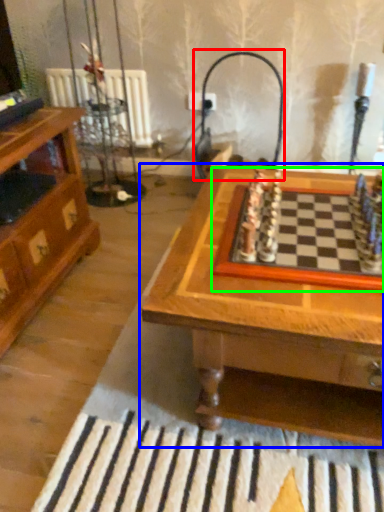
Question: Considering the real-world distances, which object is closest to lamp (highlighted by a red box)? table (highlighted by a blue box) or board game (highlighted by a green box).

Choices:
 (A) table
 (B) board game

Answer: (B)